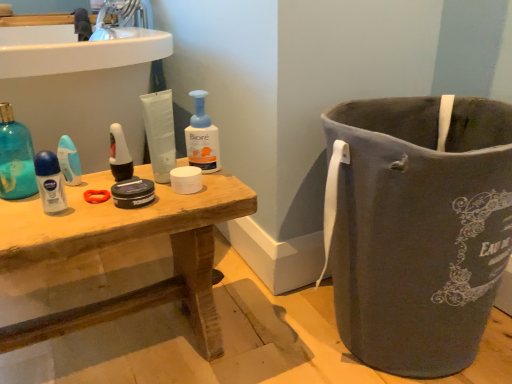
Identify the location of vacant area to the right of matte white shaving cream at left. This screenshot has width=512, height=384. (135, 200).